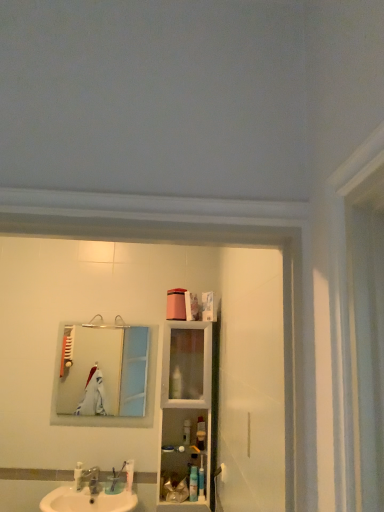
This screenshot has width=384, height=512. Find the location of `clear glass cabinet at center`. clear glass cabinet at center is located at coordinates (185, 409).

Find the location of a particular element. translucent plastic container at center, the fourth toiletry positioned from the right is located at coordinates (187, 432).

Image resolution: width=384 pixels, height=512 pixels. What do you see at coordinates (87, 479) in the screenshot?
I see `brushed metal faucet at sink front` at bounding box center [87, 479].

Measure the distance between point (77, 479) and camera.

The distance of point (77, 479) from camera is 8.70 feet.

Locate an element on the screen. This screenshot has height=512, width=384. blue plastic toothpaste tube at lower center, marked as the 3th toiletry in a right-to-left arrangement is located at coordinates (193, 484).

Does silver metallic mirror at upper left lie behind clear glass cabinet at center?

Yes, silver metallic mirror at upper left is further from the camera.

From the image's perspective, does silver metallic mirror at upper left appear higher than clear glass cabinet at center?

Yes, from the image's perspective, silver metallic mirror at upper left is above clear glass cabinet at center.

Would you say clear glass cabinet at center is part of silver metallic mirror at upper left's contents?

No, clear glass cabinet at center is not inside silver metallic mirror at upper left.

From the image's perspective, is white plastic toothbrush at lower center above or below white glossy sink at lower left?

From the image's perspective, white plastic toothbrush at lower center appears above white glossy sink at lower left.

Are white plastic toothbrush at lower center and white glossy sink at lower left making contact?

No, white plastic toothbrush at lower center is not touching white glossy sink at lower left.

Considering the points (116, 476) and (77, 477), which point is in front, point (116, 476) or point (77, 477)?

Point (116, 476)

From a real-world perspective, does silver metallic mirror at upper left stand above blue plastic toothbrush at lower center, the 1th toiletry from the right?

Yes.

Measure the distance between silver metallic mirror at upper left and blue plastic toothbrush at lower center, the fifth toiletry when ordered from left to right.

They are 2.22 meters apart.

Considering the relative sizes of silver metallic mirror at upper left and blue plastic toothbrush at lower center, the 1th toiletry from the right, in the image provided, is silver metallic mirror at upper left bigger than blue plastic toothbrush at lower center, the 1th toiletry from the right,?

Yes, silver metallic mirror at upper left is bigger than blue plastic toothbrush at lower center, the 1th toiletry from the right.

Which is more to the right, silver metallic mirror at upper left or blue plastic toothbrush at lower center, the fifth toiletry when ordered from left to right?

blue plastic toothbrush at lower center, the fifth toiletry when ordered from left to right.

Does blue plastic toothpaste tube at lower center, the 3th toiletry when ordered from left to right, turn towards silver metallic mirror at upper left?

No, blue plastic toothpaste tube at lower center, the 3th toiletry when ordered from left to right, does not turn towards silver metallic mirror at upper left.

How far apart are blue plastic toothpaste tube at lower center, the 3th toiletry when ordered from left to right, and silver metallic mirror at upper left?

7.25 feet.

From the image's perspective, which object appears higher, blue plastic toothpaste tube at lower center, the 3th toiletry when ordered from left to right, or silver metallic mirror at upper left?

silver metallic mirror at upper left.

From a real-world perspective, which object rests below the other?

blue plastic toothpaste tube at lower center, marked as the 3th toiletry in a right-to-left arrangement, is physically lower.

Which of these two, translucent plastic bottle at lower center, which ranks as the second toiletry in right-to-left order, or white plastic toothbrush at lower center, is smaller?

With smaller size is translucent plastic bottle at lower center, which ranks as the second toiletry in right-to-left order.

Is the position of translucent plastic bottle at lower center, the fourth toiletry in the left-to-right sequence, less distant than that of white plastic toothbrush at lower center?

Yes, it is in front of white plastic toothbrush at lower center.

In terms of height, does translucent plastic bottle at lower center, the fourth toiletry in the left-to-right sequence, look taller or shorter compared to white plastic toothbrush at lower center?

Clearly, translucent plastic bottle at lower center, the fourth toiletry in the left-to-right sequence, is shorter compared to white plastic toothbrush at lower center.

You are a GUI agent. You are given a task and a screenshot of the screen. Output one action in this format:
    pyautogui.click(x=<x>, y=<y>)
    Task: Click on the 2nd toiletry in front when counting from the white plastic toothbrush at lower center
    The image size is (384, 512).
    Given the screenshot: What is the action you would take?
    pyautogui.click(x=200, y=440)

Is translucent plastic bottle at lower center, which ranks as the second toiletry in right-to-left order, not near silver metallic mirror at upper left?

translucent plastic bottle at lower center, which ranks as the second toiletry in right-to-left order, is far away from silver metallic mirror at upper left.

Considering the positions of objects translucent plastic bottle at lower center, the fourth toiletry in the left-to-right sequence, and silver metallic mirror at upper left in the image provided, who is more to the right, translucent plastic bottle at lower center, the fourth toiletry in the left-to-right sequence, or silver metallic mirror at upper left?

translucent plastic bottle at lower center, the fourth toiletry in the left-to-right sequence.

In the image, is translucent plastic bottle at lower center, the fourth toiletry in the left-to-right sequence, positioned in front of or behind silver metallic mirror at upper left?

translucent plastic bottle at lower center, the fourth toiletry in the left-to-right sequence, is in front of silver metallic mirror at upper left.

From the image's perspective, which is above, translucent plastic bottle at lower center, which ranks as the second toiletry in right-to-left order, or silver metallic mirror at upper left?

silver metallic mirror at upper left appears higher in the image.

Does point (203, 435) come in front of point (93, 486)?

No, (203, 435) is further to viewer.

Considering the positions of objects translucent plastic bottle at lower center, which ranks as the second toiletry in right-to-left order, and brushed metal faucet at sink front in the image provided, who is in front, translucent plastic bottle at lower center, which ranks as the second toiletry in right-to-left order, or brushed metal faucet at sink front?

brushed metal faucet at sink front is closer to the camera.

Who is taller, translucent plastic bottle at lower center, which ranks as the second toiletry in right-to-left order, or brushed metal faucet at sink front?

brushed metal faucet at sink front is taller.

You are a GUI agent. You are given a task and a screenshot of the screen. Output one action in this format:
    pyautogui.click(x=<x>, y=<y>)
    Task: Click on the cabinet in front of the silver metallic mirror at upper left
    This screenshot has height=512, width=384.
    Given the screenshot: What is the action you would take?
    pyautogui.click(x=185, y=409)

I want to click on sink below the white plastic toothbrush at lower center (from the image's perspective), so click(87, 500).

Based on their spatial positions, is clear glass cabinet at center or silver metallic mirror at upper left further from translucent plastic bottle at lower center, which ranks as the second toiletry in right-to-left order?

silver metallic mirror at upper left.

Based on the photo, from the image, which object appears to be nearer to translucent plastic container at center, the fourth toiletry positioned from the right, silver metallic mirror at upper left or blue plastic toothpaste tube at lower center, the 3th toiletry when ordered from left to right?

blue plastic toothpaste tube at lower center, the 3th toiletry when ordered from left to right, is closer to translucent plastic container at center, the fourth toiletry positioned from the right.

When comparing their distances from blue plastic toothpaste tube at lower center, the 3th toiletry when ordered from left to right, does white glossy sink at lower left or clear glass cabinet at center seem closer?

Among the two, clear glass cabinet at center is located nearer to blue plastic toothpaste tube at lower center, the 3th toiletry when ordered from left to right.

When comparing their distances from translucent plastic container at center, which is the 2th toiletry in left-to-right order, does blue plastic toothpaste tube at lower center, marked as the 3th toiletry in a right-to-left arrangement, or blue plastic toothbrush at lower center, the fifth toiletry when ordered from left to right, seem further?

blue plastic toothbrush at lower center, the fifth toiletry when ordered from left to right.

Estimate the real-world distances between objects in this image. Which object is further from white plastic toothbrush at lower left, which ranks as the 5th toiletry in right-to-left order, brushed metal faucet at sink front or white glossy sink at lower left?

The object further to white plastic toothbrush at lower left, which ranks as the 5th toiletry in right-to-left order, is white glossy sink at lower left.

Which object lies nearer to the anchor point blue plastic toothbrush at lower center, the 1th toiletry from the right, translucent plastic bottle at lower center, the fourth toiletry in the left-to-right sequence, or brushed metal faucet at sink front?

The object closer to blue plastic toothbrush at lower center, the 1th toiletry from the right, is translucent plastic bottle at lower center, the fourth toiletry in the left-to-right sequence.

When comparing their distances from blue plastic toothbrush at lower center, the 1th toiletry from the right, does translucent plastic bottle at lower center, the fourth toiletry in the left-to-right sequence, or translucent plastic container at center, the fourth toiletry positioned from the right, seem further?

translucent plastic container at center, the fourth toiletry positioned from the right, is positioned further to the anchor blue plastic toothbrush at lower center, the 1th toiletry from the right.

When comparing their distances from brushed metal faucet at sink front, does white plastic toothbrush at lower center or white plastic toothbrush at lower left, which ranks as the 5th toiletry in right-to-left order, seem closer?

The object closer to brushed metal faucet at sink front is white plastic toothbrush at lower left, which ranks as the 5th toiletry in right-to-left order.

This screenshot has height=512, width=384. I want to click on toothbrush between white plastic toothbrush at lower left, marked as the first toiletry in a left-to-right arrangement, and translucent plastic bottle at lower center, which ranks as the second toiletry in right-to-left order, in the horizontal direction, so click(x=116, y=476).

Find the location of `mirror between white plastic toothbrush at lower left, marked as the first toiletry in a left-to-right arrangement, and clear glass cabinet at center`. mirror between white plastic toothbrush at lower left, marked as the first toiletry in a left-to-right arrangement, and clear glass cabinet at center is located at coordinates (103, 370).

You are a GUI agent. You are given a task and a screenshot of the screen. Output one action in this format:
    pyautogui.click(x=<x>, y=<y>)
    Task: Click on the toothbrush between white glossy sink at lower left and blue plastic toothpaste tube at lower center, marked as the 3th toiletry in a right-to-left arrangement
    This screenshot has height=512, width=384.
    Given the screenshot: What is the action you would take?
    pyautogui.click(x=116, y=476)

The height and width of the screenshot is (512, 384). In order to click on cabinet between brushed metal faucet at sink front and translucent plastic bottle at lower center, the fourth toiletry in the left-to-right sequence, in the horizontal direction in this screenshot , I will do `click(185, 409)`.